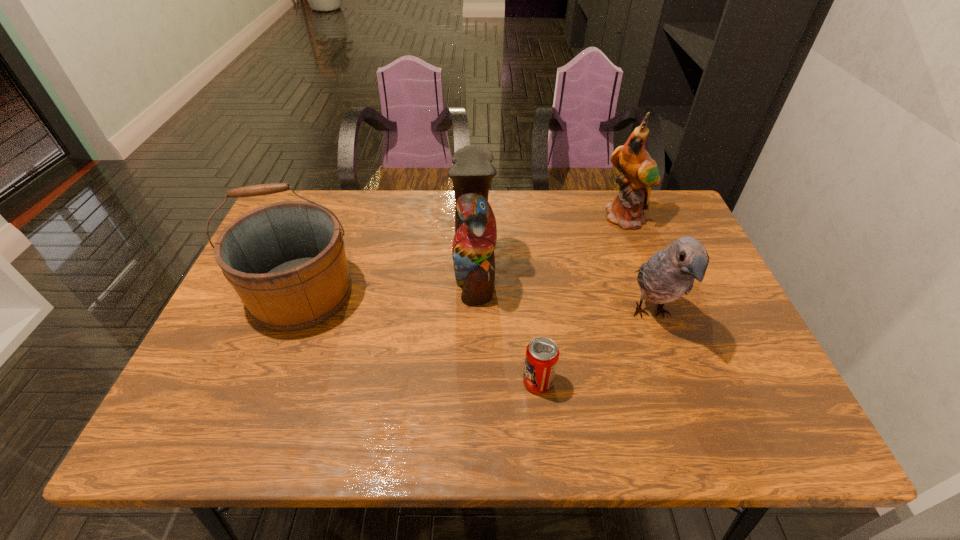
The height and width of the screenshot is (540, 960). Find the location of `vacant point that satisfies the following two spatial constraints: 1. at the face of the fourth object from right to left; 2. on the right side of the soda can`. vacant point that satisfies the following two spatial constraints: 1. at the face of the fourth object from right to left; 2. on the right side of the soda can is located at coordinates (472, 382).